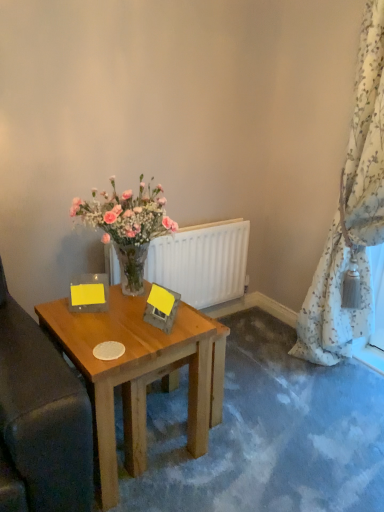
Question: From the image's perspective, is white matte radiator at center located above floral-patterned fabric at right?

Choices:
 (A) no
 (B) yes

Answer: (A)

Question: Does white matte radiator at center contain floral-patterned fabric at right?

Choices:
 (A) no
 (B) yes

Answer: (A)

Question: Does white matte radiator at center have a greater width compared to floral-patterned fabric at right?

Choices:
 (A) no
 (B) yes

Answer: (A)

Question: From a real-world perspective, is white matte radiator at center positioned under floral-patterned fabric at right based on gravity?

Choices:
 (A) yes
 (B) no

Answer: (A)

Question: Is the position of white matte radiator at center more distant than that of floral-patterned fabric at right?

Choices:
 (A) no
 (B) yes

Answer: (B)

Question: Considering the positions of point (203, 252) and point (329, 289), is point (203, 252) closer or farther from the camera than point (329, 289)?

Choices:
 (A) closer
 (B) farther

Answer: (B)

Question: From the image's perspective, is white matte radiator at center located above or below floral-patterned fabric at right?

Choices:
 (A) below
 (B) above

Answer: (A)

Question: In the image, is white matte radiator at center positioned in front of or behind floral-patterned fabric at right?

Choices:
 (A) behind
 (B) front

Answer: (A)

Question: In terms of height, does white matte radiator at center look taller or shorter compared to floral-patterned fabric at right?

Choices:
 (A) tall
 (B) short

Answer: (B)

Question: From the image's perspective, is white matte radiator at center above or below wooden table at center?

Choices:
 (A) below
 (B) above

Answer: (B)

Question: Do you think white matte radiator at center is within wooden table at center, or outside of it?

Choices:
 (A) inside
 (B) outside

Answer: (B)

Question: In the image, is white matte radiator at center on the left side or the right side of wooden table at center?

Choices:
 (A) left
 (B) right

Answer: (B)

Question: Based on their sizes in the image, would you say white matte radiator at center is bigger or smaller than wooden table at center?

Choices:
 (A) small
 (B) big

Answer: (A)

Question: Which is correct: wooden table at center is inside floral-patterned fabric at right, or outside of it?

Choices:
 (A) inside
 (B) outside

Answer: (B)

Question: Does point pyautogui.click(x=114, y=483) appear closer or farther from the camera than point pyautogui.click(x=322, y=351)?

Choices:
 (A) closer
 (B) farther

Answer: (A)